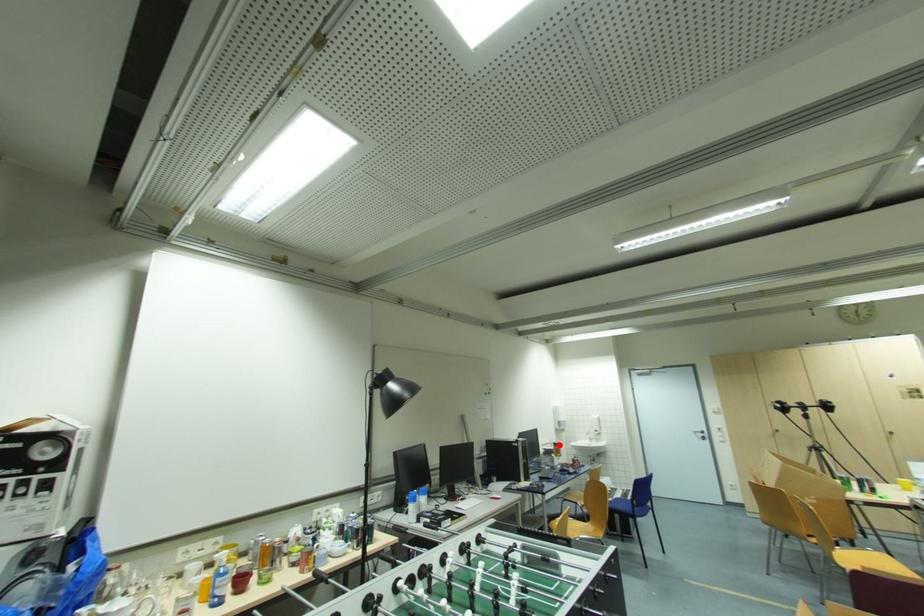
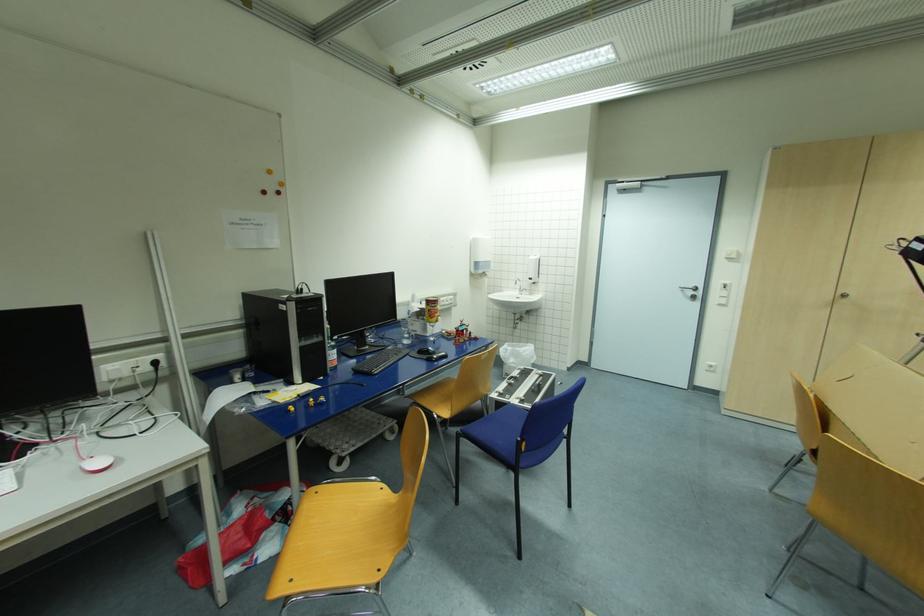
The point at the highlighted location is marked in the first image. Where is the corresponding point in the second image?

(433, 302)